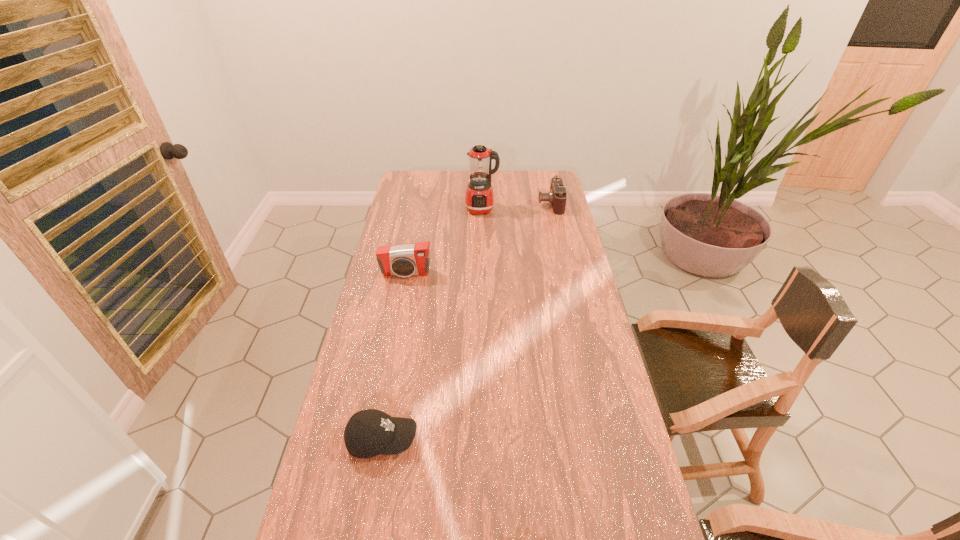
At what (x,y) coordinates should I click in order to perform the action: click on free spot that satisfies the following two spatial constraints: 1. on the controls of the tallest object; 2. on the front-facing side of the nearest object. Please return your answer as a coordinate pair (x, y). Looking at the image, I should click on (483, 440).

Identify the location of free location that satisfies the following two spatial constraints: 1. on the controls of the third object from left to right; 2. on the front-facing side of the nearest object. (483, 440).

Identify the location of vacant space that satisfies the following two spatial constraints: 1. on the front-facing side of the rightmost object; 2. on the front-facing side of the third shortest object. (566, 274).